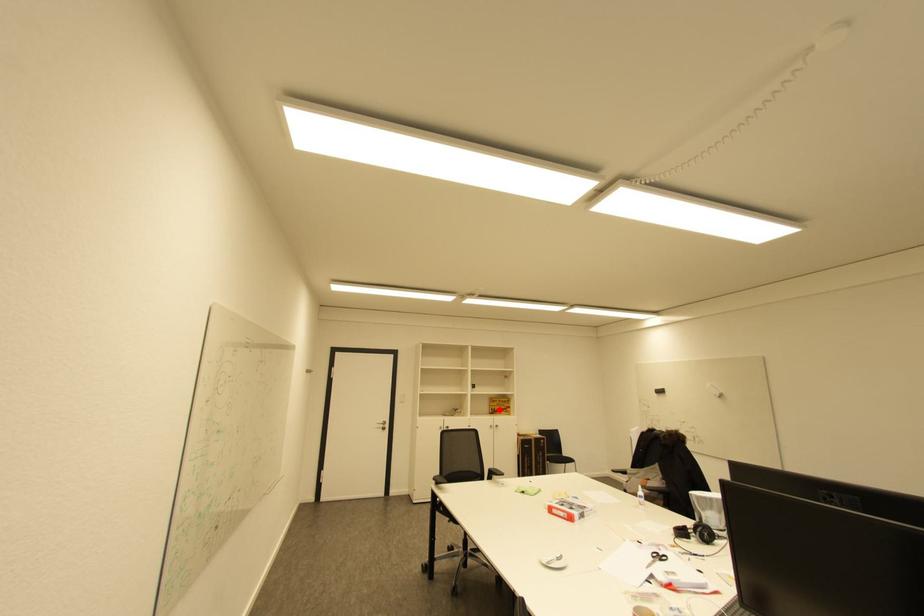
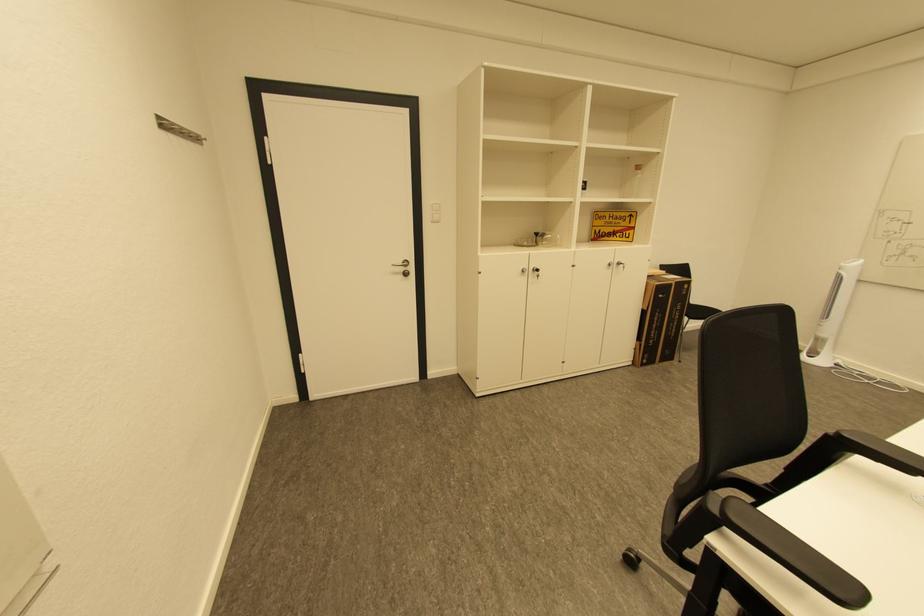
Question: I am providing you with two images of the same scene from different viewpoints. A red point is marked on the first image. At the location where the point appears in image 1, is it still visible in image 2?

Choices:
 (A) Yes
 (B) No

Answer: (A)